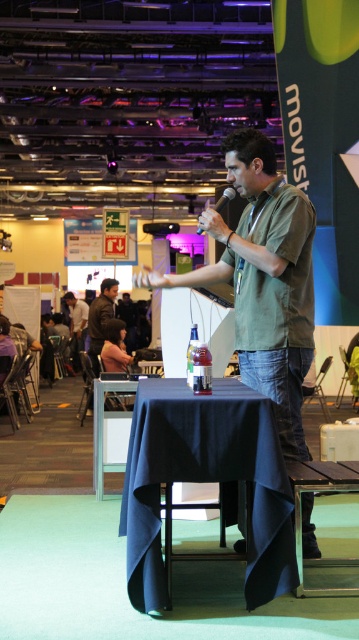
You are organizing a virtual event and need to ensure that the speaker can be seen clearly on camera. The camera has a focus range that can only capture objects within 25 inches. Given the distance between the green matte shirt at center and the matte black microphone at upper center, will the camera be able to focus on both items simultaneously?

The green matte shirt at center and the matte black microphone at upper center are 25.19 inches apart from each other. Since the camera can only focus within 25 inches, the distance between them exceeds the focus range, so the camera cannot focus on both items simultaneously.

In the scene shown: You are an attendee at the event and want to know the location of the speaker. Based on the image, where is the green matte shirt at center in relation to the matte black microphone at upper center?

The green matte shirt at center is positioned under the matte black microphone at upper center, indicating the speaker is standing below the microphone.